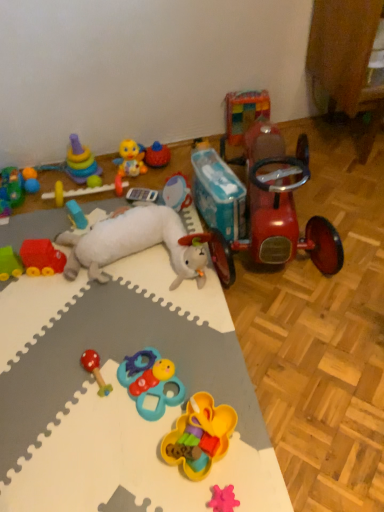
In order to click on free area in between pink rubber bear at lower center, the 3th toy when ordered from right to left, and wooden/matte rattle at lower left, marked as the 9th toy in a right-to-left arrangement in this screenshot , I will do `click(161, 438)`.